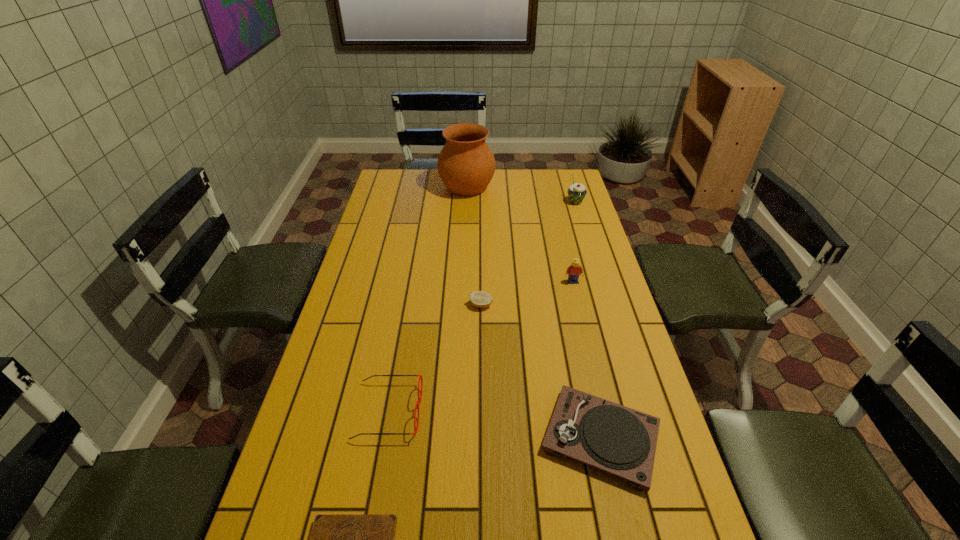
The height and width of the screenshot is (540, 960). In order to click on pottery in this screenshot , I will do `click(466, 165)`.

Locate an element on the screen. This screenshot has width=960, height=540. cupcake is located at coordinates (576, 192).

I want to click on the third farthest object, so click(574, 270).

You are a GUI agent. You are given a task and a screenshot of the screen. Output one action in this format:
    pyautogui.click(x=<x>, y=<y>)
    Task: Click on the fifth shortest object
    
    Given the screenshot: What is the action you would take?
    click(574, 270)

Identify the location of spectacles. This screenshot has width=960, height=540. (419, 399).

The height and width of the screenshot is (540, 960). I want to click on phonograph_record, so click(x=611, y=437).

Find the location of a particular element. the second shortest object is located at coordinates (481, 299).

Identify the location of the fourth nearest object. Image resolution: width=960 pixels, height=540 pixels. [481, 299].

Find the location of a particular element. free space located on the front of the pottery is located at coordinates (465, 234).

Identify the location of vacant space situated on the back of the sixth shortest object. This screenshot has height=540, width=960. (569, 181).